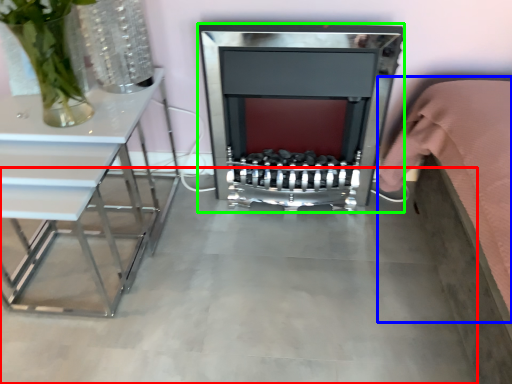
Question: Which object is the farthest from concrete (highlighted by a red box)? Choose among these: bed (highlighted by a blue box) or fireplace (highlighted by a green box).

Choices:
 (A) bed
 (B) fireplace

Answer: (A)